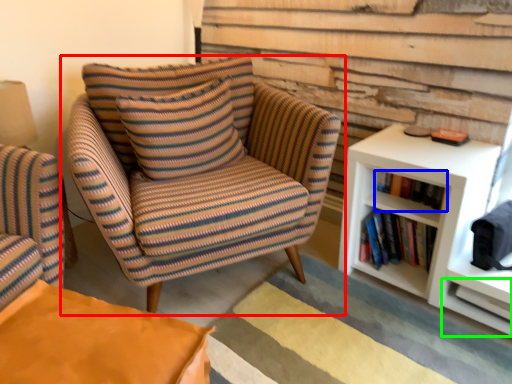
Question: Which is nearer to the chair (highlighted by a red box)? book (highlighted by a blue box) or shelf (highlighted by a green box).

Choices:
 (A) book
 (B) shelf

Answer: (A)